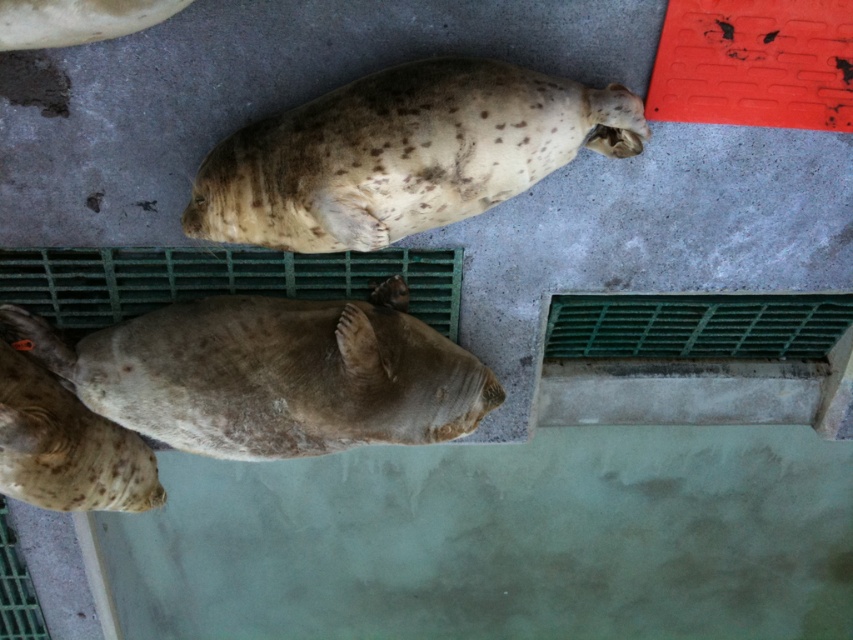
Question: Is speckled fur seal at upper center further to the viewer compared to speckled fur seal at center?

Choices:
 (A) yes
 (B) no

Answer: (B)

Question: Which point is closer to the camera taking this photo?

Choices:
 (A) (x=642, y=109)
 (B) (x=167, y=0)
 (C) (x=352, y=397)

Answer: (B)

Question: Considering the real-world distances, which object is closest to the speckled fur seal at center?

Choices:
 (A) speckled fur seal at upper left
 (B) speckled fur seal at lower left
 (C) speckled fur seal at upper center

Answer: (B)

Question: Does speckled fur seal at upper center have a greater width compared to speckled fur seal at lower left?

Choices:
 (A) no
 (B) yes

Answer: (B)

Question: Which of these objects is positioned farthest from the speckled fur seal at center?

Choices:
 (A) speckled fur seal at upper center
 (B) speckled fur seal at upper left
 (C) speckled fur seal at lower left

Answer: (B)

Question: Can you confirm if speckled fur seal at lower left is thinner than speckled fur seal at upper left?

Choices:
 (A) no
 (B) yes

Answer: (B)